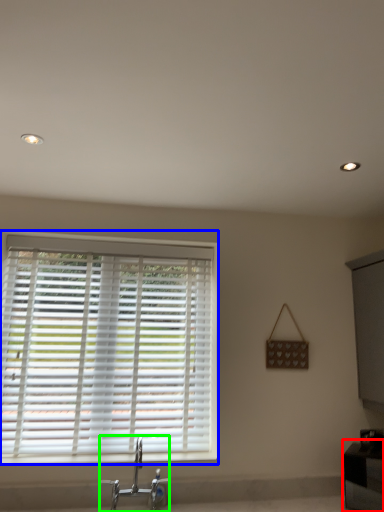
Question: Which object is positioned farthest from vanity (highlighted by a red box)? Select from window blind (highlighted by a blue box) and tap (highlighted by a green box).

Choices:
 (A) window blind
 (B) tap

Answer: (A)